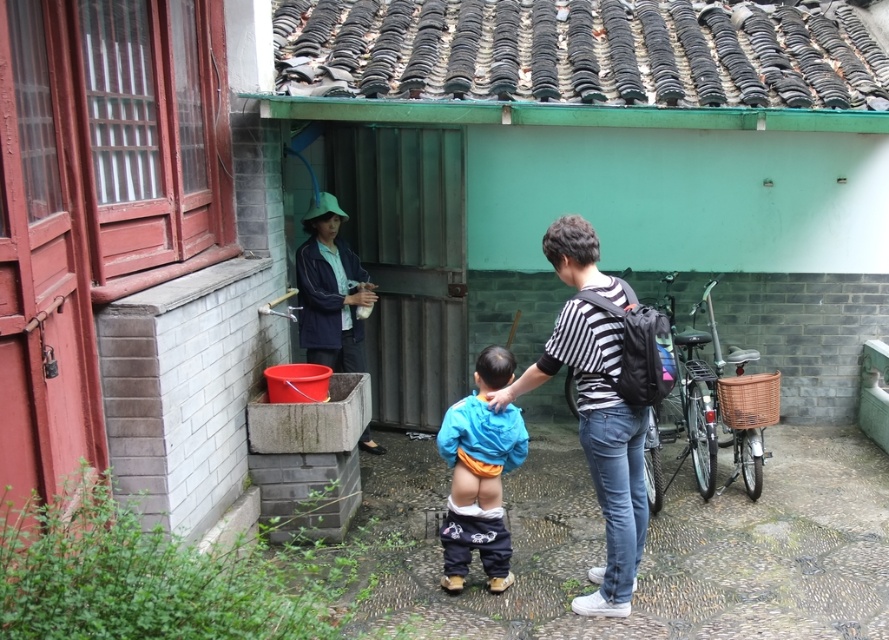
You are a painter who needs to paint the green painted brick wall at center and the blue denim jacket at left. Which object requires more horizontal space to paint?

The green painted brick wall at center requires more horizontal space to paint because it is wider than the blue denim jacket at left.

You are standing at the entrance of the residential area and want to take a photo of the green painted brick wall at center. Based on its position, where should you position yourself to capture it in the frame?

The green painted brick wall at center is located at point (630, 152), so you should position yourself slightly to the left and lower down to ensure it is centered in your camera frame.

You are a painter who needs to decide which wall to paint first. The green painted brick wall at center and the smooth concrete wall at lower left are both in need of touchups. Based on their heights, which wall should you tackle first if you want to start with the shorter one?

The green painted brick wall at center has a lesser height compared to the smooth concrete wall at lower left, so you should paint the green painted brick wall at center first since it is shorter.